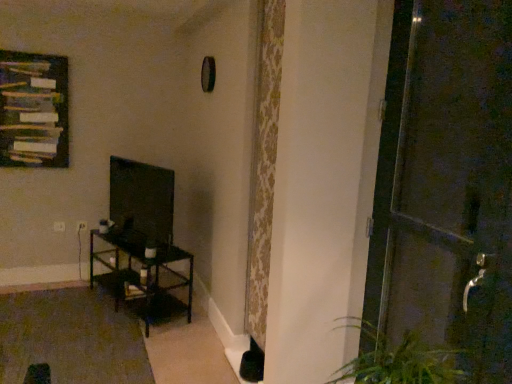
Question: Is wooden frame at upper left bigger or smaller than matte black tv at left?

Choices:
 (A) small
 (B) big

Answer: (A)

Question: From the image's perspective, is wooden frame at upper left positioned above or below matte black tv at left?

Choices:
 (A) above
 (B) below

Answer: (A)

Question: Estimate the real-world distances between objects in this image. Which object is closer to the wooden frame at upper left?

Choices:
 (A) dark brown metal table at left
 (B) matte black tv at left
 (C) metallic dark brown door at right

Answer: (B)

Question: Considering the real-world distances, which object is closest to the metallic dark brown door at right?

Choices:
 (A) matte black tv at left
 (B) dark brown metal table at left
 (C) wooden frame at upper left

Answer: (B)